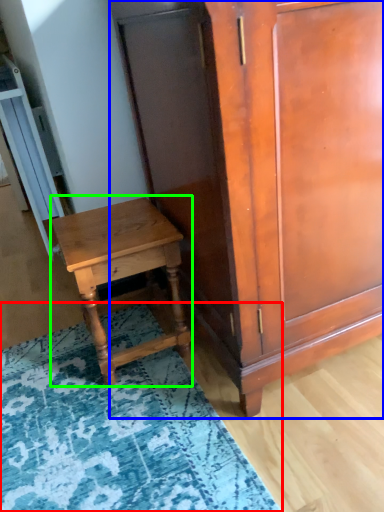
Question: Which object is positioned farthest from mat (highlighted by a red box)? Select from cabinetry (highlighted by a blue box) and nightstand (highlighted by a green box).

Choices:
 (A) cabinetry
 (B) nightstand

Answer: (A)